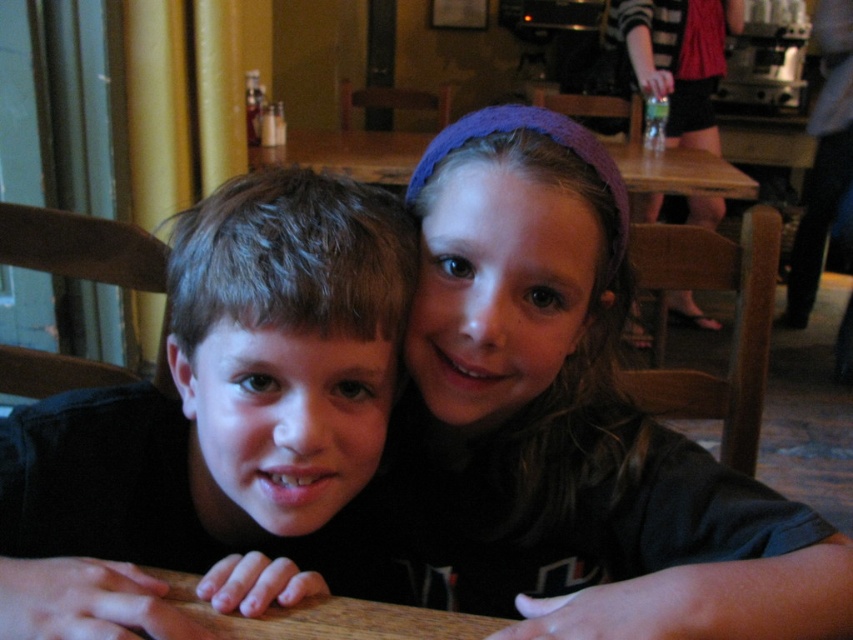
Question: Does purple knitted headband at upper center come in front of matte black shirt at center?

Choices:
 (A) no
 (B) yes

Answer: (B)

Question: Can you confirm if purple knitted headband at upper center is positioned to the right of green plastic bottle at upper right?

Choices:
 (A) yes
 (B) no

Answer: (B)

Question: Which point is farther to the camera?

Choices:
 (A) purple knitted headband at upper center
 (B) matte black shirt at center

Answer: (B)

Question: In this image, where is purple knitted headband at upper center located relative to matte black shirt at center?

Choices:
 (A) right
 (B) left

Answer: (A)

Question: Which of these objects is positioned closest to the green plastic bottle at upper right?

Choices:
 (A) purple knitted headband at upper center
 (B) matte black shirt at center

Answer: (A)

Question: Which point is farther to the camera?

Choices:
 (A) pos(720,552)
 (B) pos(64,470)

Answer: (B)